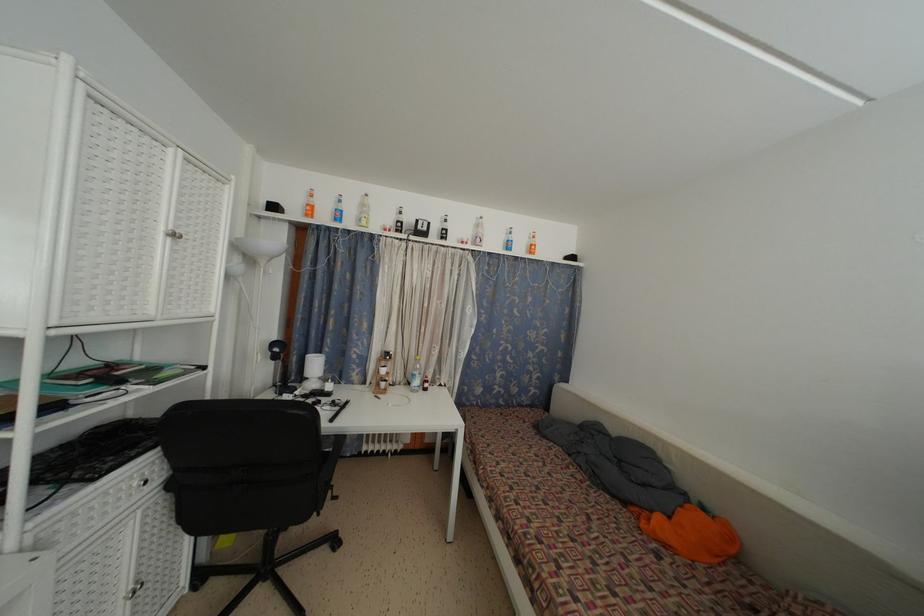
The location [337,209] corresponds to which object?

This point indicates the blue soda bottle.